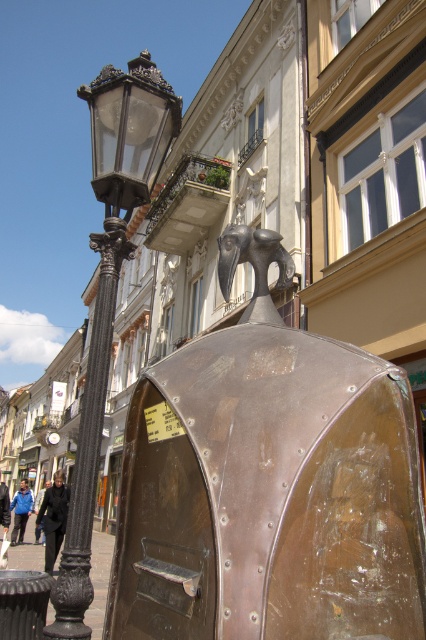
Question: Which point is farther to the camera?

Choices:
 (A) polished bronze bird at center
 (B) bronze/copper textured mailbox at center
 (C) black wrought iron pole at left
 (D) black glass lamp post at left

Answer: (D)

Question: Which object is positioned closest to the black wrought iron pole at left?

Choices:
 (A) bronze/copper textured mailbox at center
 (B) polished bronze bird at center
 (C) black glass lamp post at left

Answer: (C)

Question: Does black glass lamp post at left have a larger size compared to polished bronze bird at center?

Choices:
 (A) no
 (B) yes

Answer: (B)

Question: Among these objects, which one is nearest to the camera?

Choices:
 (A) black wrought iron pole at left
 (B) polished bronze bird at center
 (C) bronze/copper textured mailbox at center
 (D) black glass lamp post at left

Answer: (C)

Question: Does black glass lamp post at left appear on the left side of black wrought iron pole at left?

Choices:
 (A) yes
 (B) no

Answer: (B)

Question: Does bronze/copper textured mailbox at center have a greater width compared to polished bronze bird at center?

Choices:
 (A) yes
 (B) no

Answer: (A)